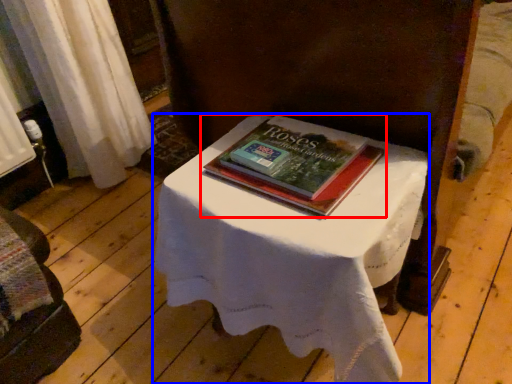
Question: Which object appears farthest to the camera in this image, book (highlighted by a red box) or table (highlighted by a blue box)?

Choices:
 (A) book
 (B) table

Answer: (A)